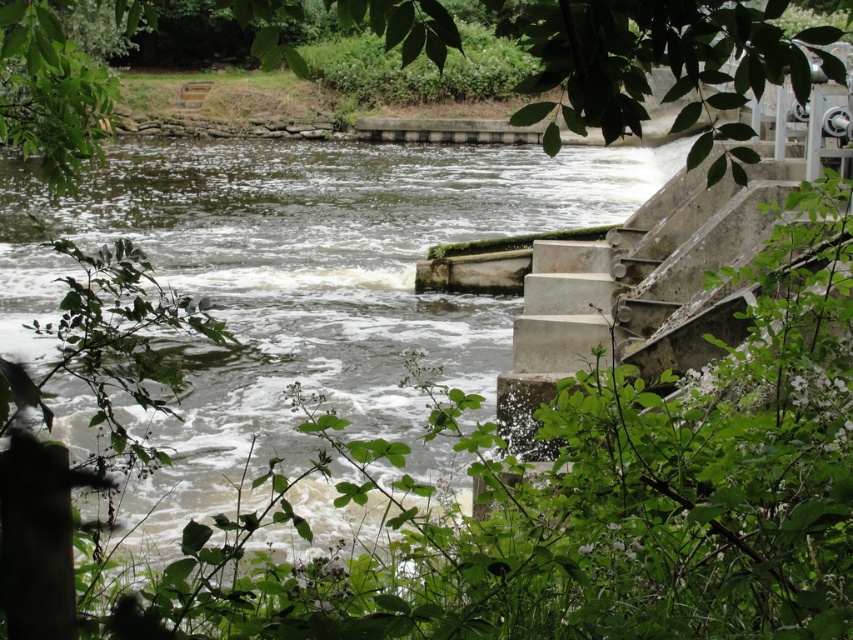
You are a hiker who wants to cross the river. You see the dark green concrete river at center and the concrete stairs at right. Which one is closer to you?

The dark green concrete river at center is in front of the concrete stairs at right, so it is closer to you.

You are standing at the center of the image and want to reach the concrete stairs at right. Which direction should you move to get there?

You should move to the right to reach the concrete stairs at right since they are located at the right side of the image.

You are a hiker who wants to reach the base of the waterfall. You see the concrete stairs at right and the green leafy tree at upper left. Which object is closer to the waterfall?

The concrete stairs at right is located below the green leafy tree at upper left, so the concrete stairs at right is closer to the waterfall.